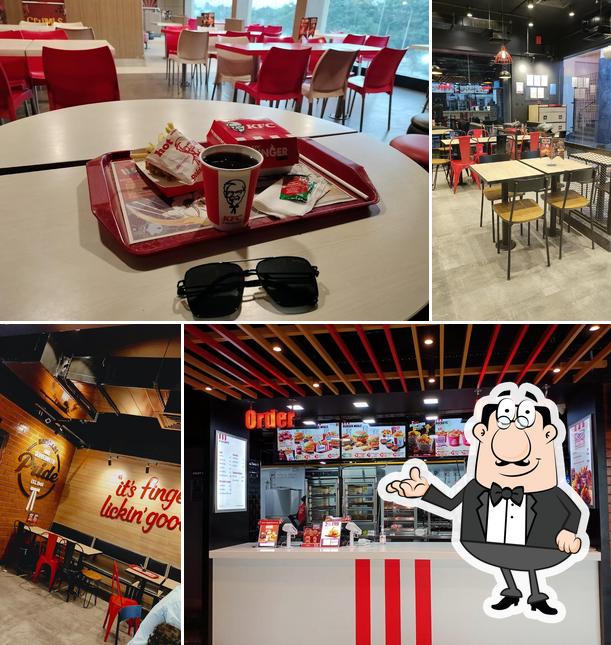
The width and height of the screenshot is (611, 645). What are the coordinates of `tray` in the screenshot? It's located at (137, 568), (143, 226).